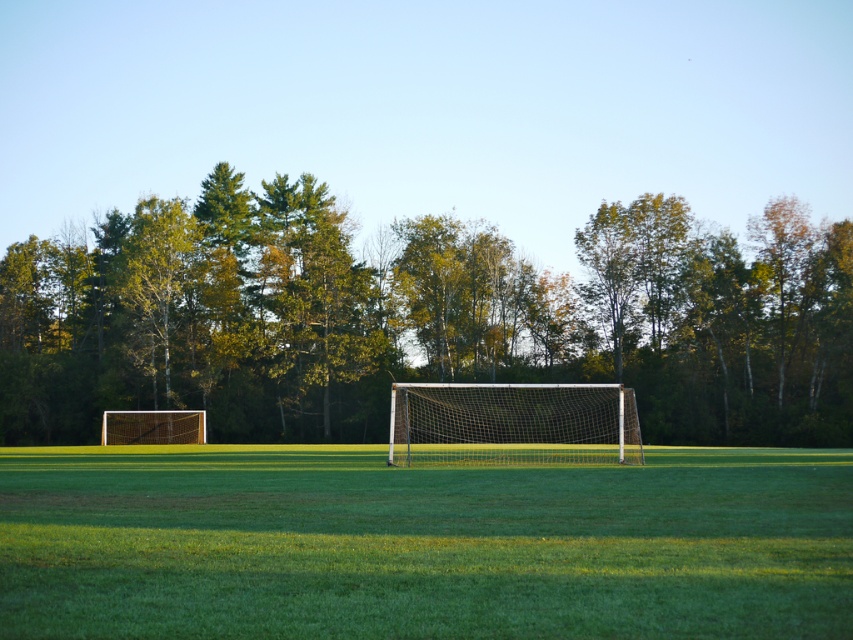
In the scene shown: You are a soccer player preparing to take a penalty kick. You notice the white mesh net at center and the metallic silver goal at left. Which object is taller?

The white mesh net at center is taller than the metallic silver goal at left.

You are a soccer player standing at one end of the field. You want to kick a ball to the other end goal. If you aim for the green grass at center and the white mesh net at center, which area is wider to ensure the ball stays within the field?

The green grass at center is wider than the white mesh net at center, so aiming for the green grass at center would give a wider area to stay within the field.